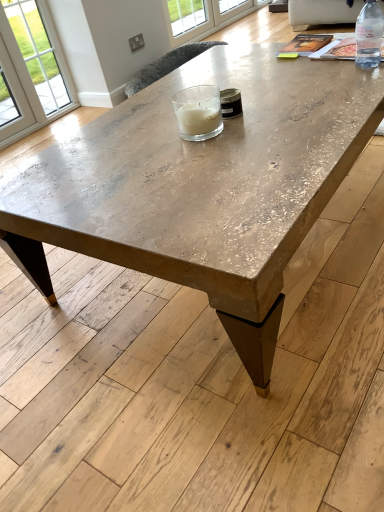
Question: Considering the relative positions of clear plastic bottle at upper right and clear glass window at upper center in the image provided, is clear plastic bottle at upper right to the left of clear glass window at upper center from the viewer's perspective?

Choices:
 (A) yes
 (B) no

Answer: (B)

Question: From the image's perspective, does clear plastic bottle at upper right appear higher than clear glass window at upper center?

Choices:
 (A) yes
 (B) no

Answer: (B)

Question: Is clear glass window at upper center located within clear plastic bottle at upper right?

Choices:
 (A) yes
 (B) no

Answer: (B)

Question: Can you confirm if clear plastic bottle at upper right is thinner than clear glass window at upper center?

Choices:
 (A) no
 (B) yes

Answer: (A)

Question: Is clear plastic bottle at upper right oriented towards clear glass window at upper center?

Choices:
 (A) no
 (B) yes

Answer: (A)

Question: Does clear plastic bottle at upper right come in front of clear glass window at upper center?

Choices:
 (A) no
 (B) yes

Answer: (B)

Question: Is clear glass window at upper center smaller than clear glass candle at center?

Choices:
 (A) yes
 (B) no

Answer: (B)

Question: Could you tell me if clear glass window at upper center is facing clear glass candle at center?

Choices:
 (A) yes
 (B) no

Answer: (B)

Question: Does clear glass window at upper center appear on the right side of clear glass candle at center?

Choices:
 (A) yes
 (B) no

Answer: (A)

Question: From the image's perspective, is clear glass window at upper center on clear glass candle at center?

Choices:
 (A) yes
 (B) no

Answer: (A)

Question: Is clear glass candle at center at the back of clear glass window at upper center?

Choices:
 (A) no
 (B) yes

Answer: (A)

Question: Does clear glass window at upper center have a greater width compared to clear glass candle at center?

Choices:
 (A) yes
 (B) no

Answer: (B)

Question: From the image's perspective, would you say clear plastic bottle at upper right is positioned over clear glass candle at center?

Choices:
 (A) no
 (B) yes

Answer: (B)